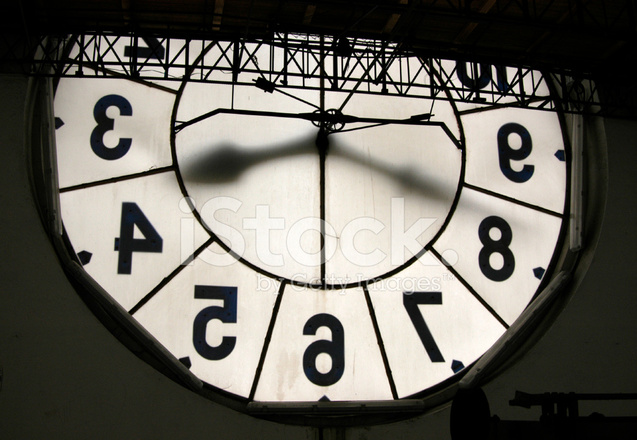
You are a GUI agent. You are given a task and a screenshot of the screen. Output one action in this format:
    pyautogui.click(x=<x>, y=<y>)
    Task: Click on the support beam
    
    Given the screenshot: What is the action you would take?
    pyautogui.click(x=339, y=436), pyautogui.click(x=322, y=437)